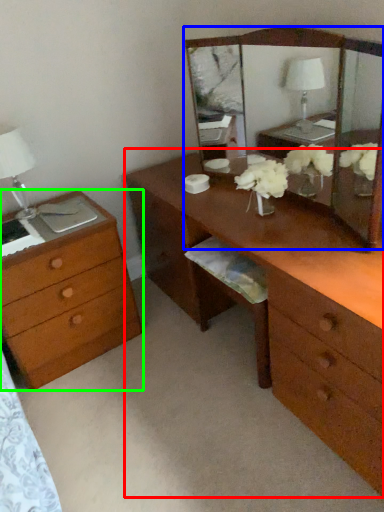
Question: Considering the real-world distances, which object is farthest from desk (highlighted by a red box)? mirror (highlighted by a blue box) or chest of drawers (highlighted by a green box)?

Choices:
 (A) mirror
 (B) chest of drawers

Answer: (A)